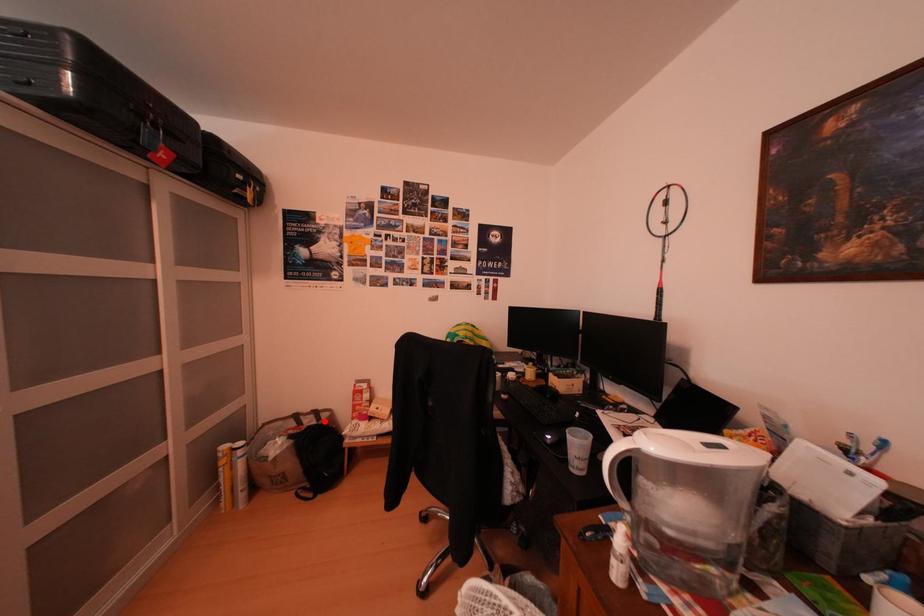
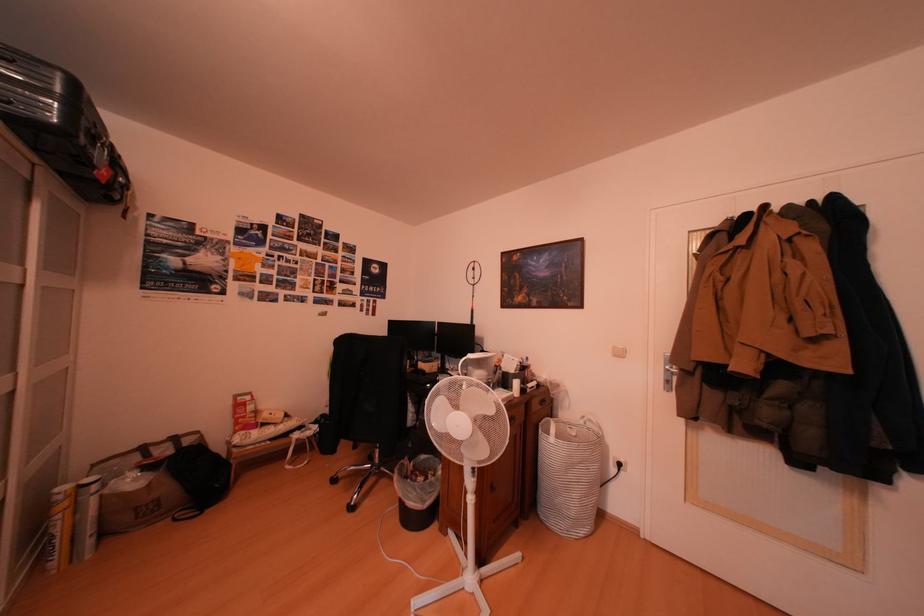
Question: I am providing you with two images of the same scene from different viewpoints. In image1, a red point is highlighted. Considering the same 3D point in image2, which of the following is correct?

Choices:
 (A) It is closer
 (B) It is farther

Answer: (A)